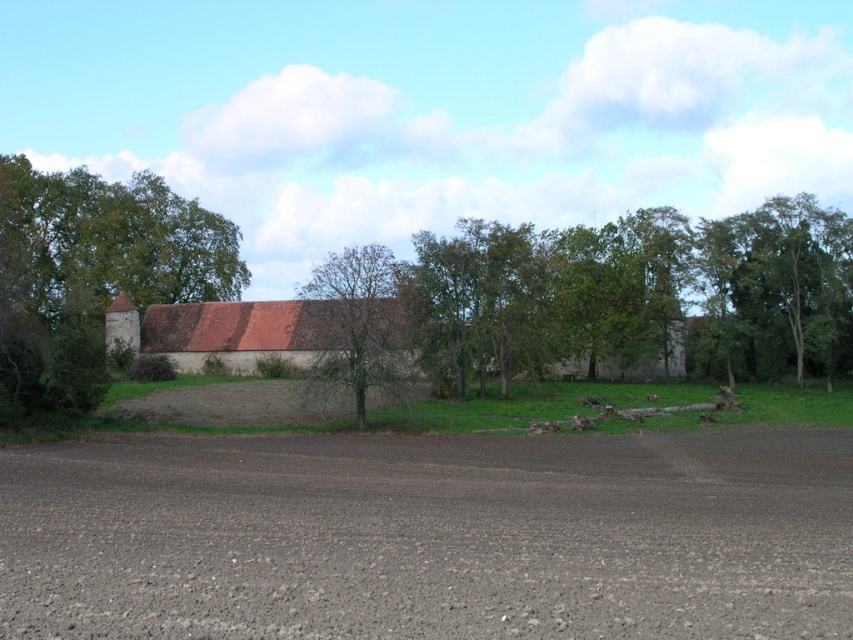
Question: Is green grass at center bigger than bare wood tree at center?

Choices:
 (A) no
 (B) yes

Answer: (A)

Question: Which object appears farthest from the camera in this image?

Choices:
 (A) green leafy tree at upper right
 (B) green leafy tree at center
 (C) green grass at center

Answer: (A)

Question: Which point is closer to the camera?

Choices:
 (A) brown clay barn at center
 (B) bare wood tree at center
 (C) green leafy tree at center

Answer: (A)

Question: Is brown clay barn at center bigger than bare wood tree at center?

Choices:
 (A) no
 (B) yes

Answer: (A)

Question: Considering the real-world distances, which object is closest to the green grass at center?

Choices:
 (A) brown soil at lower center
 (B) brown clay barn at center
 (C) green leafy tree at center

Answer: (C)

Question: Is green leafy tree at left to the left of bare wood tree at center from the viewer's perspective?

Choices:
 (A) yes
 (B) no

Answer: (A)